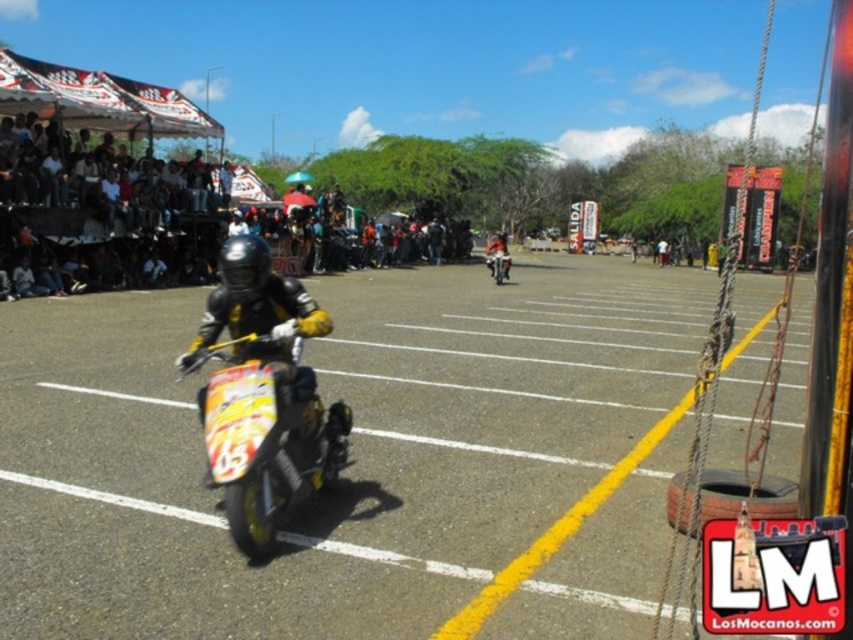
You are a photographer positioned at the edge of the track. You want to take a photo of the motorcycle race scene. There are two points in the image labeled as point 1 at coordinates point [422,516] and point 2 at coordinates point [57,147]. Which point is closer to your camera?

Point [422,516] is closer to the camera than point [57,147].

You are a drone operator trying to capture the motorcycle race. You have two points marked on your screen at coordinates point (231,403) and point (502,262). From the perspective of the motorcyclist, which point is closer to the starting line?

Point (231,403) is in front of point (502,262), so it is closer to the starting line from the motorcyclist perspective.